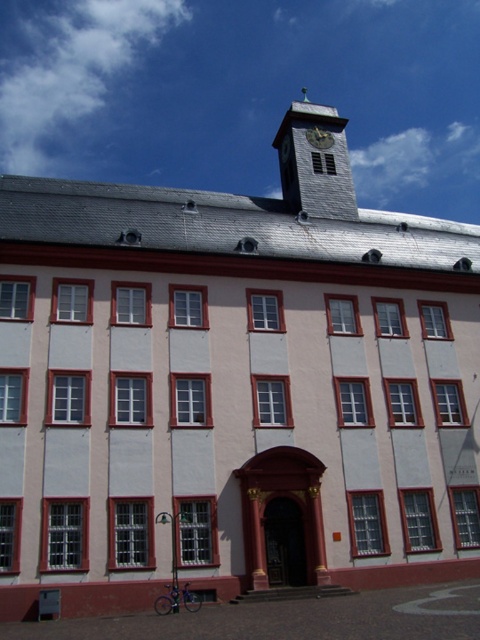
You are an architect analyzing the building structure. Based on the image, which object is positioned higher on the building facade between the gray stone clock tower at upper center and the gold metallic clock at upper center?

The gray stone clock tower at upper center is positioned higher than the gold metallic clock at upper center.

You are a maintenance worker needing to reach both the gray stone clock tower at upper center and the gold metallic clock at upper center. The ladder you have can extend up to 25 meters. Can you safely reach both objects with your current ladder?

The distance between the gray stone clock tower at upper center and the gold metallic clock at upper center is 27.33 meters, which exceeds the ladder extension limit of 25 meters. Therefore, you cannot safely reach both objects with your current ladder.